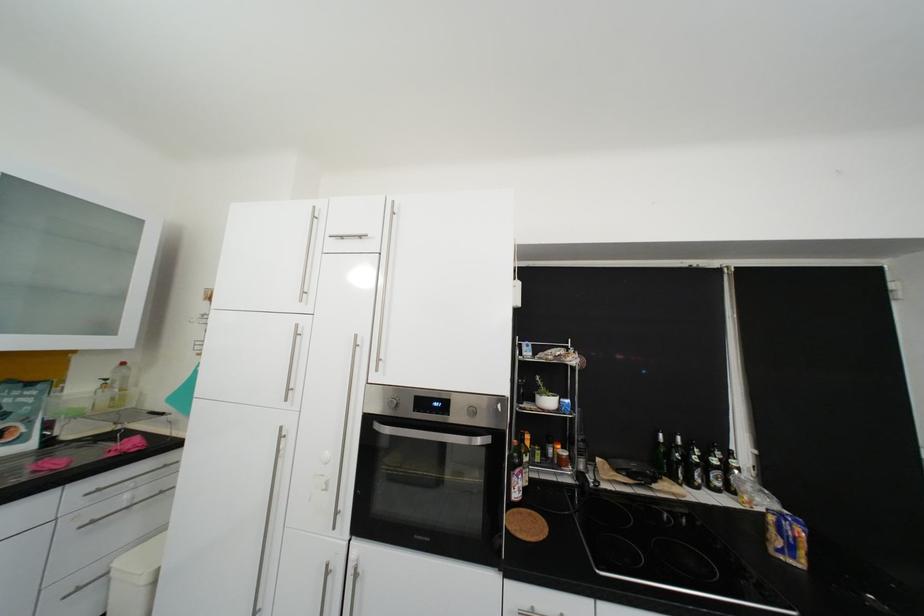
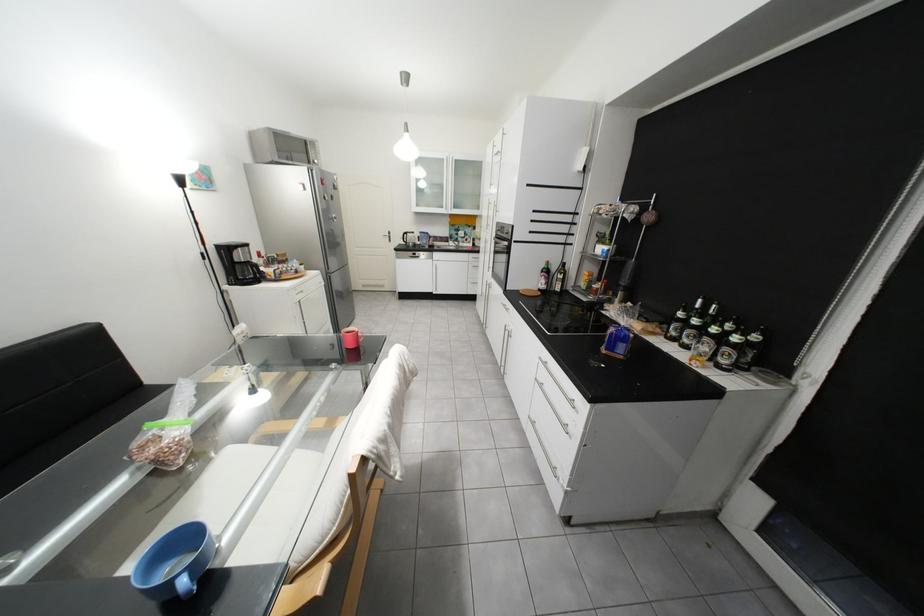
Find the pixel in the second image that matches the point at 550,460 in the first image.

(596, 288)